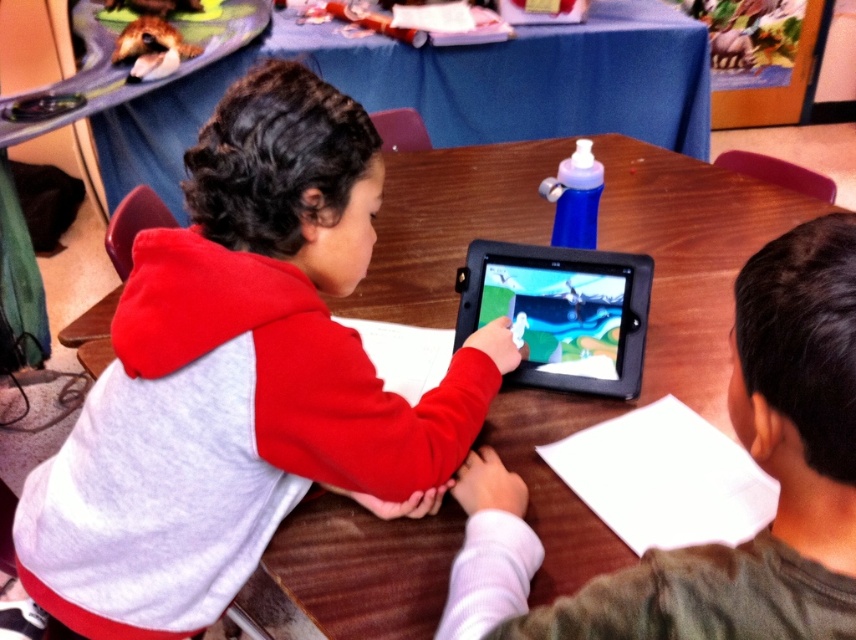
Question: Is matte red hoodie at center further to the viewer compared to black plastic tablet at center?

Choices:
 (A) no
 (B) yes

Answer: (A)

Question: Which object is the farthest from the black plastic tablet at center?

Choices:
 (A) smooth black tablet at center
 (B) matte red hoodie at center

Answer: (A)

Question: Which of these objects is positioned closest to the black plastic tablet at center?

Choices:
 (A) matte red hoodie at center
 (B) smooth black tablet at center

Answer: (A)

Question: Can you confirm if smooth black tablet at center is positioned to the left of black plastic tablet at center?

Choices:
 (A) yes
 (B) no

Answer: (A)

Question: Is matte red hoodie at center to the left of black plastic tablet at center from the viewer's perspective?

Choices:
 (A) yes
 (B) no

Answer: (A)

Question: Among these objects, which one is nearest to the camera?

Choices:
 (A) black plastic tablet at center
 (B) matte red hoodie at center

Answer: (B)